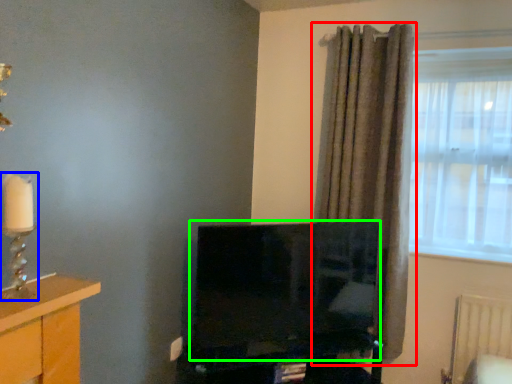
Question: Based on their relative distances, which object is nearer to curtain (highlighted by a red box)? Choose from candle holder (highlighted by a blue box) and television (highlighted by a green box).

Choices:
 (A) candle holder
 (B) television

Answer: (B)